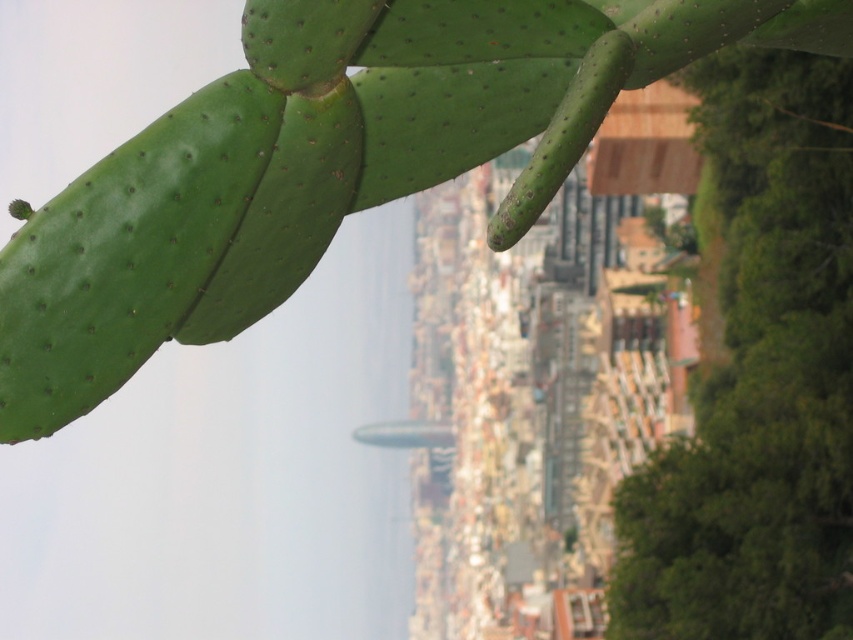
You are an architect designing a garden in a city. You have a blueprint where the cactus must be placed at coordinate point 0.256, 0.385. Looking at the image, does the green spiny cactus at upper left match the required placement?

Yes, the green spiny cactus at upper left is positioned at point [328,163], so it matches the required placement.

You are standing in a garden and want to take a photo of the green spiny cactus at upper left and the green leafy tree at right. Which object should you focus on first if you want both to be in focus?

To have both the green spiny cactus at upper left and the green leafy tree at right in focus, you should focus on the green spiny cactus at upper left first since it is closer to the viewer, allowing the tree to be within the depth of field.

You are an artist sketching the scene. You need to decide which object to draw first based on their sizes. According to the scene, which object should you sketch first, the green spiny cactus at upper left or the green leafy tree at right?

The green spiny cactus at upper left is smaller than the green leafy tree at right, so you should sketch the green leafy tree at right first as it is larger and might require more space in your drawing.